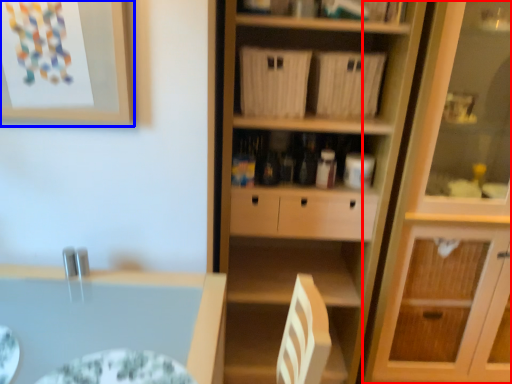
Question: Which of the following is the closest to the observer, cabinetry (highlighted by a red box) or picture frame (highlighted by a blue box)?

Choices:
 (A) cabinetry
 (B) picture frame

Answer: (B)